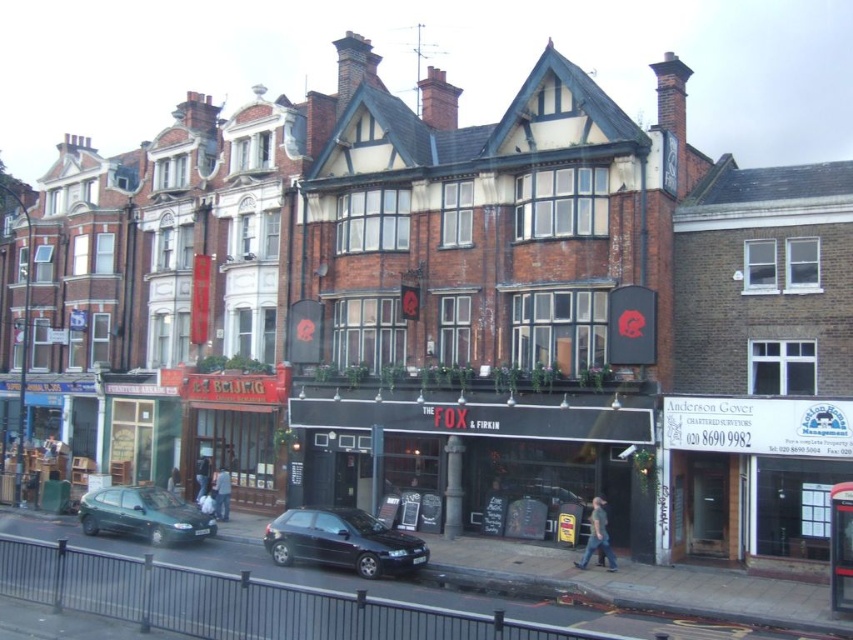
Question: Is black matte signboard at center wider than metallic green hatchback at lower left?

Choices:
 (A) yes
 (B) no

Answer: (A)

Question: Among these points, which one is farthest from the camera?

Choices:
 (A) (379, 554)
 (B) (503, 436)

Answer: (B)

Question: Does black matte signboard at center have a larger size compared to metallic green hatchback at lower left?

Choices:
 (A) yes
 (B) no

Answer: (A)

Question: Does black matte signboard at center have a larger size compared to metallic green hatchback at lower left?

Choices:
 (A) yes
 (B) no

Answer: (A)

Question: Which of these objects is positioned farthest from the black matte signboard at center?

Choices:
 (A) shiny black car at center
 (B) metallic green hatchback at lower left

Answer: (B)

Question: Which point is farther to the camera?

Choices:
 (A) (354, 548)
 (B) (128, 528)

Answer: (B)